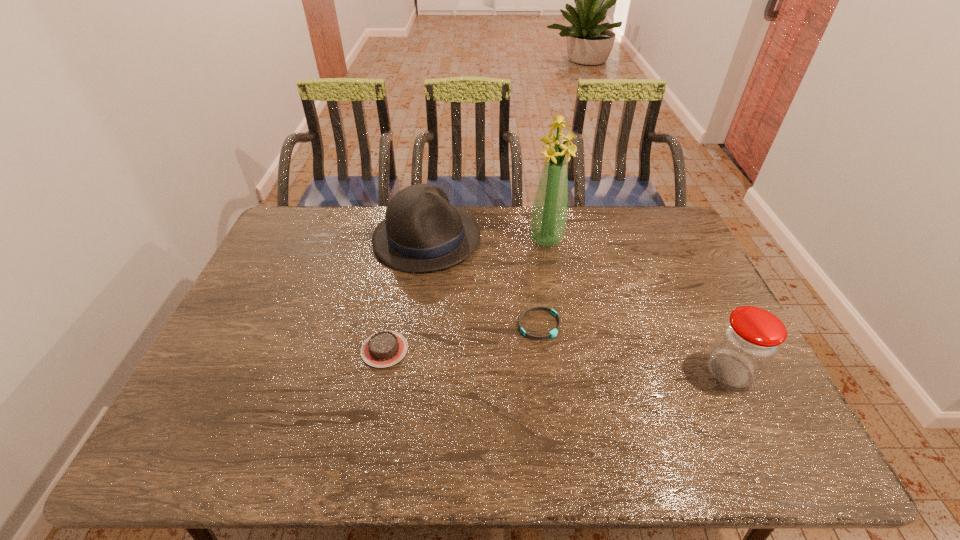
Where is `vacant space on the desktop that is between the second shortest object and the jar and is positioned on the front-facing side of the bowler hat`? vacant space on the desktop that is between the second shortest object and the jar and is positioned on the front-facing side of the bowler hat is located at coordinates (584, 362).

Locate an element on the screen. The width and height of the screenshot is (960, 540). vacant space on the desktop that is between the second shortest object and the rightmost object and is positioned on the buckle of the shortest object is located at coordinates (602, 363).

At what (x,y) coordinates should I click in order to perform the action: click on vacant spot on the desktop that is between the fourth tallest object and the rightmost object and is positioned on the front-facing side of the bouquet. Please return your answer as a coordinate pair (x, y). Looking at the image, I should click on (561, 361).